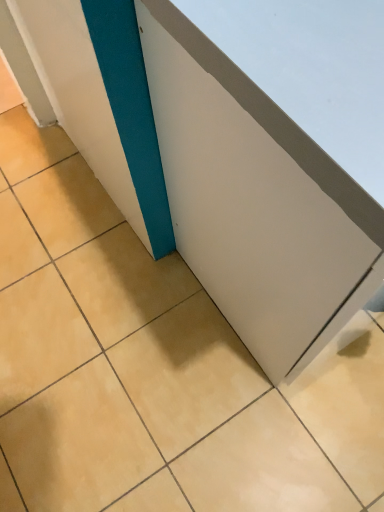
Describe the element at coordinates (256, 200) in the screenshot. I see `matte white cabinet at lower right` at that location.

Image resolution: width=384 pixels, height=512 pixels. In order to click on matte white cabinet at lower right in this screenshot , I will do `click(256, 200)`.

Locate an element on the screen. matte white cabinet at lower right is located at coordinates (256, 200).